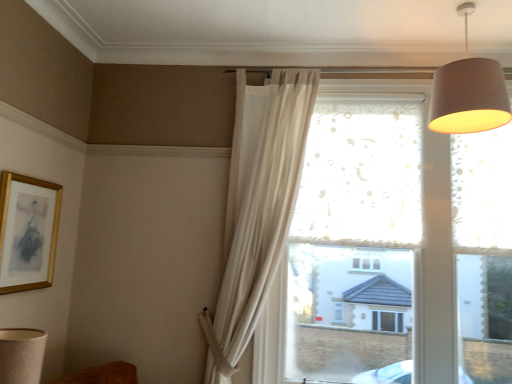
Question: From a real-world perspective, is matte gray lampshade at upper right positioned under gold wooden picture frame at upper left based on gravity?

Choices:
 (A) yes
 (B) no

Answer: (B)

Question: Is matte gray lampshade at upper right to the left of gold wooden picture frame at upper left from the viewer's perspective?

Choices:
 (A) yes
 (B) no

Answer: (B)

Question: Is matte gray lampshade at upper right positioned with its back to gold wooden picture frame at upper left?

Choices:
 (A) yes
 (B) no

Answer: (B)

Question: Considering the relative sizes of matte gray lampshade at upper right and gold wooden picture frame at upper left in the image provided, is matte gray lampshade at upper right bigger than gold wooden picture frame at upper left?

Choices:
 (A) no
 (B) yes

Answer: (B)

Question: Is matte gray lampshade at upper right positioned behind gold wooden picture frame at upper left?

Choices:
 (A) yes
 (B) no

Answer: (B)

Question: Is matte gray lampshade at upper right wider than gold wooden picture frame at upper left?

Choices:
 (A) no
 (B) yes

Answer: (B)

Question: Is matte gray lampshade at upper right next to frosted glass window at center and touching it?

Choices:
 (A) no
 (B) yes

Answer: (A)

Question: From the image's perspective, is matte gray lampshade at upper right below frosted glass window at center?

Choices:
 (A) no
 (B) yes

Answer: (A)

Question: Is matte gray lampshade at upper right behind frosted glass window at center?

Choices:
 (A) no
 (B) yes

Answer: (A)

Question: Is matte gray lampshade at upper right oriented away from frosted glass window at center?

Choices:
 (A) no
 (B) yes

Answer: (B)

Question: Does matte gray lampshade at upper right lie in front of frosted glass window at center?

Choices:
 (A) yes
 (B) no

Answer: (A)

Question: Is matte gray lampshade at upper right surrounding frosted glass window at center?

Choices:
 (A) no
 (B) yes

Answer: (A)

Question: Is white sheer curtain at upper center far away from beige fabric lampshade at lower left?

Choices:
 (A) no
 (B) yes

Answer: (B)